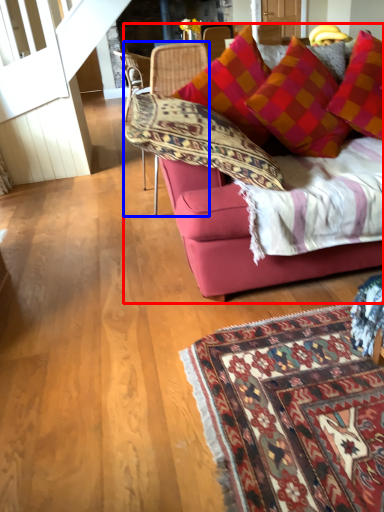
Question: Which object appears closest to the camera in this image, studio couch (highlighted by a red box) or chair (highlighted by a blue box)?

Choices:
 (A) studio couch
 (B) chair

Answer: (A)